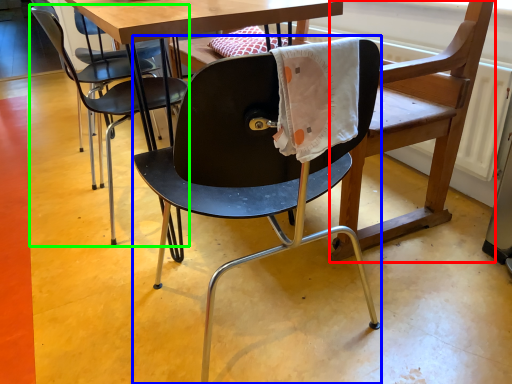
Question: Based on their relative distances, which object is farther from swivel chair (highlighted by a red box)? Choose from chair (highlighted by a blue box) and chair (highlighted by a green box).

Choices:
 (A) chair
 (B) chair

Answer: (B)